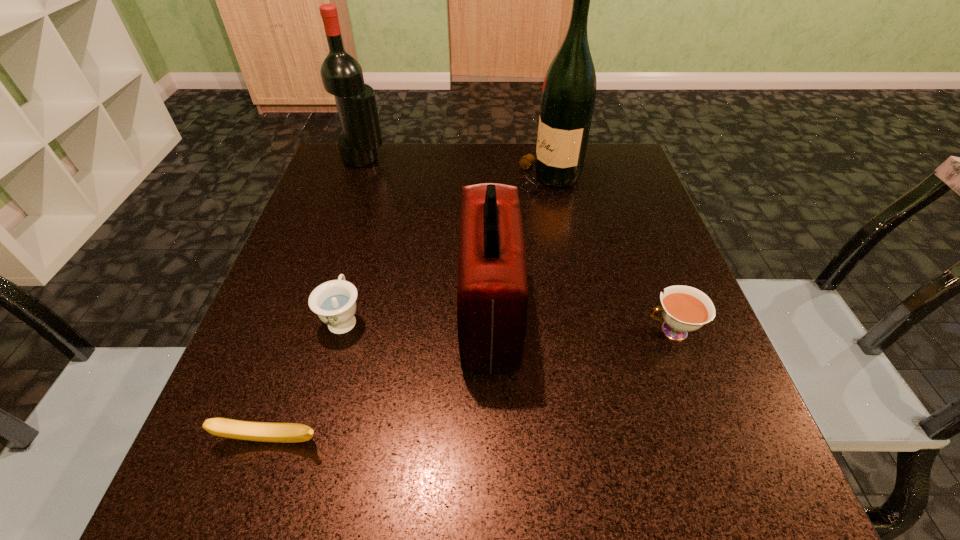
Find the location of a particular element. Image resolution: width=960 pixels, height=540 pixels. free space located on the surface of the second object from right to left is located at coordinates (363, 178).

You are a GUI agent. You are given a task and a screenshot of the screen. Output one action in this format:
    pyautogui.click(x=<x>, y=<y>)
    Task: Click on the vacant position located 0.130m on the surface of the second object from right to left
    This screenshot has width=960, height=540.
    Given the screenshot: What is the action you would take?
    pyautogui.click(x=461, y=178)

The image size is (960, 540). In order to click on vacant space situated 0.330m on the right of the shorter wine bottle in this screenshot , I will do `click(514, 159)`.

You are a GUI agent. You are given a task and a screenshot of the screen. Output one action in this format:
    pyautogui.click(x=<x>, y=<y>)
    Task: Click on the vacant space located 0.190m on the side of the third tallest object with the cross symbol
    
    Given the screenshot: What is the action you would take?
    pyautogui.click(x=352, y=314)

Find the location of a particular element. vacant point located on the side of the third tallest object with the cross symbol is located at coordinates (307, 314).

The image size is (960, 540). I want to click on free location located on the side of the third tallest object with the cross symbol, so click(381, 314).

At what (x,y) coordinates should I click in order to perform the action: click on vacant space situated 0.280m on the side of the left teacup with the handle. Please return your answer as a coordinate pair (x, y). The width and height of the screenshot is (960, 540). Looking at the image, I should click on (375, 204).

Image resolution: width=960 pixels, height=540 pixels. I want to click on free spot located on the side of the left teacup with the handle, so click(x=382, y=177).

At what (x,y) coordinates should I click in order to perform the action: click on free space located 0.100m on the side of the left teacup with the handle. Please return your answer as a coordinate pair (x, y). The width and height of the screenshot is (960, 540). Looking at the image, I should click on (360, 259).

Find the location of a particular element. free space located 0.190m on the side of the right teacup with the handle is located at coordinates (532, 331).